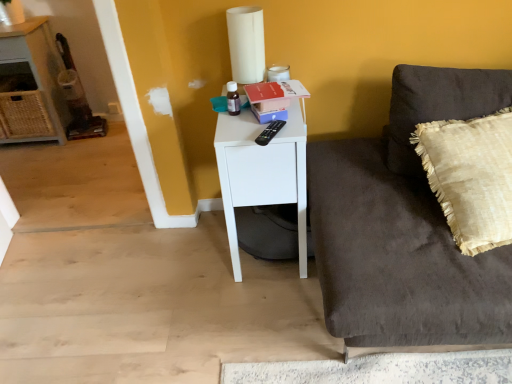
What do you see at coordinates (262, 172) in the screenshot? I see `white matte side table at center` at bounding box center [262, 172].

Identify the location of black plastic remote control at upper right. (269, 132).

Find the location of `dark brown velvety couch at right`. dark brown velvety couch at right is located at coordinates (405, 226).

Where is `woven wicker cabinet at left`? The height and width of the screenshot is (384, 512). woven wicker cabinet at left is located at coordinates (30, 84).

From the image's perspective, between woven wicker cabinet at left and dark brown velvety couch at right, which one is located above?

woven wicker cabinet at left is shown above in the image.

Does woven wicker cabinet at left have a greater height compared to dark brown velvety couch at right?

Yes.

How many degrees apart are the facing directions of woven wicker cabinet at left and dark brown velvety couch at right?

The angular difference between woven wicker cabinet at left and dark brown velvety couch at right is 3.67 degrees.

Considering the relative positions of woven wicker cabinet at left and dark brown velvety couch at right in the image provided, is woven wicker cabinet at left in front of dark brown velvety couch at right?

No, it is behind dark brown velvety couch at right.

Would you consider white matte side table at center to be distant from black plastic remote control at upper right?

No, white matte side table at center is not far away from black plastic remote control at upper right.

Which of these two, white matte side table at center or black plastic remote control at upper right, is wider?

With larger width is white matte side table at center.

Is beige textured pillow at right not near black plastic remote control at upper right?

No, beige textured pillow at right is in close proximity to black plastic remote control at upper right.

You are a GUI agent. You are given a task and a screenshot of the screen. Output one action in this format:
    pyautogui.click(x=<x>, y=<y>)
    Task: Click on the pillow on the right of black plastic remote control at upper right
    
    Given the screenshot: What is the action you would take?
    pyautogui.click(x=471, y=177)

Is black plastic remote control at upper right surrounded by beige textured pillow at right?

No, black plastic remote control at upper right is not a part of beige textured pillow at right.

Find the location of a particular element. The height and width of the screenshot is (384, 512). remote control in front of the woven wicker cabinet at left is located at coordinates (269, 132).

Does woven wicker cabinet at left have a lesser width compared to black plastic remote control at upper right?

No.

Is woven wicker cabinet at left not inside black plastic remote control at upper right?

Yes, woven wicker cabinet at left is not within black plastic remote control at upper right.

Which is behind, point (38, 118) or point (276, 127)?

The point (38, 118) is behind.

From the image's perspective, which one is positioned higher, dark brown velvety couch at right or beige textured pillow at right?

From the image's view, beige textured pillow at right is above.

Is dark brown velvety couch at right closer to camera compared to beige textured pillow at right?

That is True.

From a real-world perspective, is dark brown velvety couch at right located beneath beige textured pillow at right?

Correct, in the physical world, dark brown velvety couch at right is lower than beige textured pillow at right.

What's the angular difference between beige textured pillow at right and woven wicker cabinet at left's facing directions?

0.12 degrees separate the facing orientations of beige textured pillow at right and woven wicker cabinet at left.

Considering the points (430, 127) and (17, 65), which point is behind, point (430, 127) or point (17, 65)?

Point (17, 65)

Is beige textured pillow at right further to camera compared to woven wicker cabinet at left?

No.

Identify the location of pillow on the right of white matte side table at center. (471, 177).

Based on the photo, measure the distance from beige textured pillow at right to white matte side table at center.

They are 22.27 inches apart.

Considering the sizes of objects beige textured pillow at right and white matte side table at center in the image provided, who is smaller, beige textured pillow at right or white matte side table at center?

beige textured pillow at right.

Considering the sizes of objects beige textured pillow at right and white matte side table at center in the image provided, who is wider, beige textured pillow at right or white matte side table at center?

white matte side table at center.

In order to click on studio couch that is above the woven wicker cabinet at left (from a real-world perspective) in this screenshot , I will do coord(405,226).

At what (x,y) coordinates should I click in order to perform the action: click on remote control above the white matte side table at center (from the image's perspective). Please return your answer as a coordinate pair (x, y). This screenshot has height=384, width=512. Looking at the image, I should click on (269, 132).

Estimate the real-world distances between objects in this image. Which object is closer to dark brown velvety couch at right, beige textured pillow at right or black plastic remote control at upper right?

beige textured pillow at right is positioned closer to the anchor dark brown velvety couch at right.

Looking at the image, which one is located further to black plastic remote control at upper right, beige textured pillow at right or white matte side table at center?

Among the two, beige textured pillow at right is located further to black plastic remote control at upper right.

When comparing their distances from black plastic remote control at upper right, does dark brown velvety couch at right or woven wicker cabinet at left seem closer?

dark brown velvety couch at right.

Which object lies nearer to the anchor point dark brown velvety couch at right, woven wicker cabinet at left or white matte side table at center?

Among the two, white matte side table at center is located nearer to dark brown velvety couch at right.

When comparing their distances from dark brown velvety couch at right, does woven wicker cabinet at left or black plastic remote control at upper right seem closer?

black plastic remote control at upper right is closer to dark brown velvety couch at right.

Based on their spatial positions, is black plastic remote control at upper right or beige textured pillow at right further from woven wicker cabinet at left?

Among the two, beige textured pillow at right is located further to woven wicker cabinet at left.

Which object lies nearer to the anchor point white matte side table at center, black plastic remote control at upper right or dark brown velvety couch at right?

black plastic remote control at upper right.

Based on their spatial positions, is beige textured pillow at right or dark brown velvety couch at right closer to black plastic remote control at upper right?

dark brown velvety couch at right is positioned closer to the anchor black plastic remote control at upper right.

Where is `remote control situated between white matte side table at center and dark brown velvety couch at right from left to right`? The image size is (512, 384). remote control situated between white matte side table at center and dark brown velvety couch at right from left to right is located at coordinates (269, 132).

The height and width of the screenshot is (384, 512). Identify the location of studio couch between black plastic remote control at upper right and beige textured pillow at right in the horizontal direction. (405, 226).

Find the location of `studio couch between white matte side table at center and beige textured pillow at right`. studio couch between white matte side table at center and beige textured pillow at right is located at coordinates (405, 226).

This screenshot has width=512, height=384. Identify the location of desk between woven wicker cabinet at left and dark brown velvety couch at right. (262, 172).